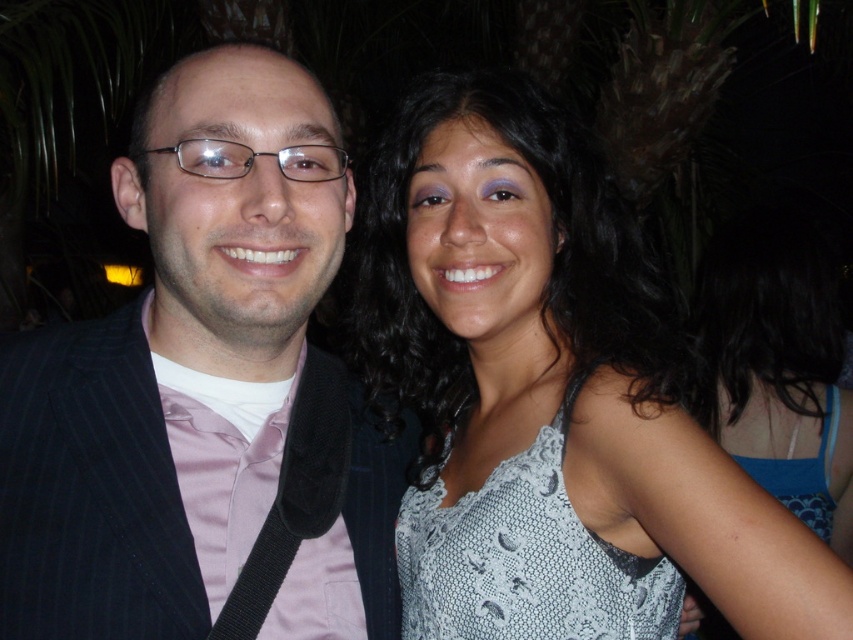
Question: Is white lace tank top at upper right to the left of blue lace tank top at upper right from the viewer's perspective?

Choices:
 (A) yes
 (B) no

Answer: (A)

Question: Can you confirm if white lace tank top at upper right is smaller than lacy white dress at center?

Choices:
 (A) no
 (B) yes

Answer: (A)

Question: Which of the following is the farthest from the observer?

Choices:
 (A) (520, 515)
 (B) (521, 481)
 (C) (287, 493)
 (D) (700, 397)

Answer: (D)

Question: Among these points, which one is farthest from the camera?

Choices:
 (A) (556, 451)
 (B) (381, 376)
 (C) (753, 317)
 (D) (190, 289)

Answer: (C)

Question: Considering the real-world distances, which object is closest to the white lace tank top at upper right?

Choices:
 (A) lacy white dress at center
 (B) black pinstripe suit at left
 (C) blue lace tank top at upper right

Answer: (A)

Question: Is white lace tank top at upper right to the left of blue lace tank top at upper right from the viewer's perspective?

Choices:
 (A) no
 (B) yes

Answer: (B)